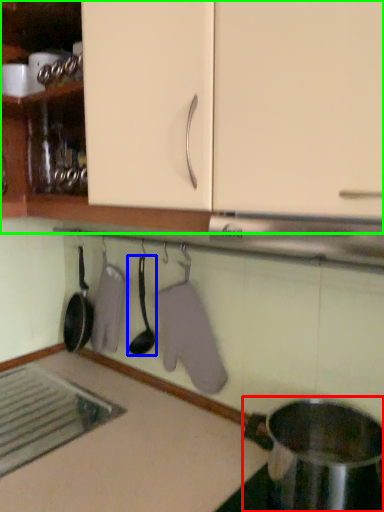
Question: Based on their relative distances, which object is nearer to appliance (highlighted by a red box)? Choose from spoon (highlighted by a blue box) and cabinetry (highlighted by a green box).

Choices:
 (A) spoon
 (B) cabinetry

Answer: (A)